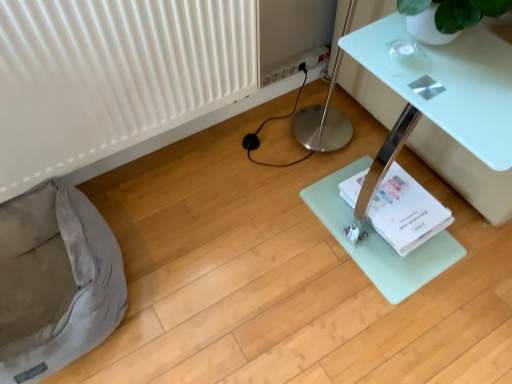
What are the coordinates of `vacant space that is in between white plastic power strip at upper center and gray fabric bean bag at lower left` in the screenshot? It's located at (188, 191).